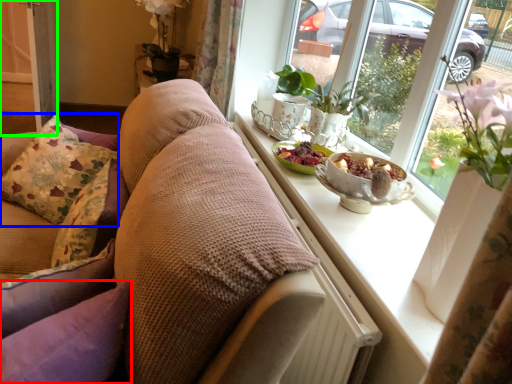
Question: Which is nearer to the pillow (highlighted by a red box)? pillow (highlighted by a blue box) or screen door (highlighted by a green box).

Choices:
 (A) pillow
 (B) screen door

Answer: (A)